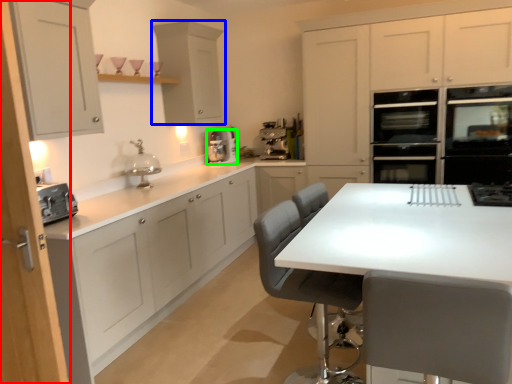
Question: Which is farther away from cabinetry (highlighted by a red box)? cabinetry (highlighted by a blue box) or kitchen appliance (highlighted by a green box)?

Choices:
 (A) cabinetry
 (B) kitchen appliance

Answer: (B)